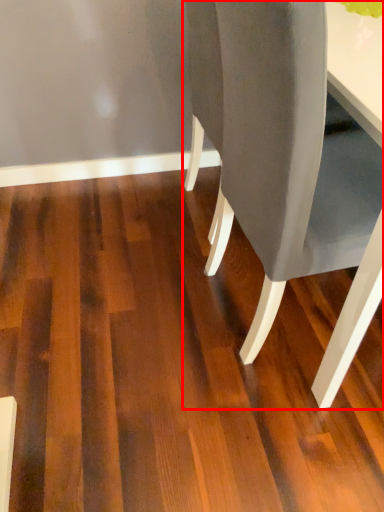
Question: From the image's perspective, what is the correct spatial relationship of chair (annotated by the red box) in relation to plywood?

Choices:
 (A) below
 (B) above

Answer: (B)